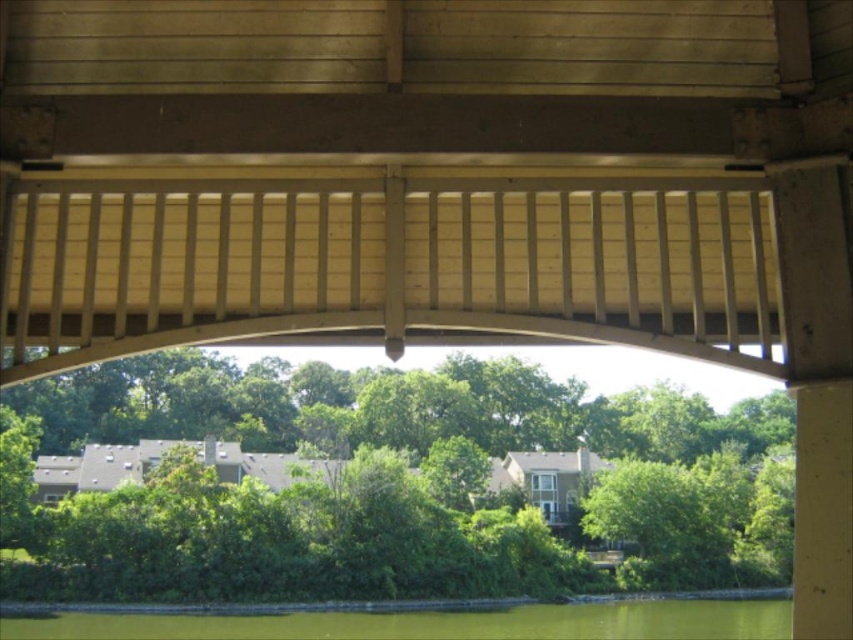
Between wooden bridge at center and green water at lower center, which one appears on the right side from the viewer's perspective?

Positioned to the right is green water at lower center.

Between wooden bridge at center and green water at lower center, which one has more height?

green water at lower center

Which is behind, point (461, 4) or point (373, 618)?

The point (373, 618) is behind.

The width and height of the screenshot is (853, 640). I want to click on wooden bridge at center, so click(427, 176).